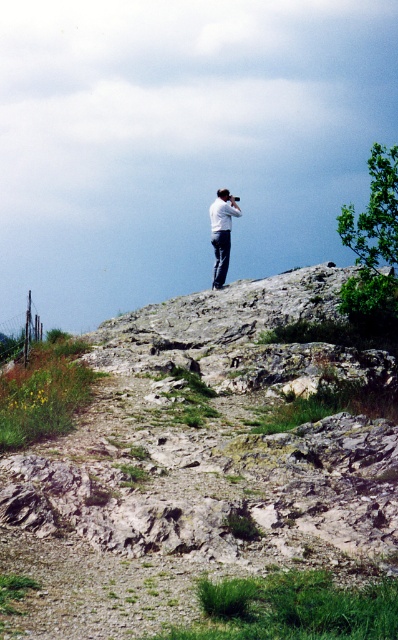
Question: Which point is farther to the camera?

Choices:
 (A) (220, 268)
 (B) (378, 474)

Answer: (A)

Question: Does gray rocky hillside at upper center appear on the left side of white fabric camera at upper center?

Choices:
 (A) yes
 (B) no

Answer: (A)

Question: Which point is closer to the camera?

Choices:
 (A) (360, 564)
 (B) (224, 266)

Answer: (A)

Question: Does gray rocky hillside at upper center appear on the left side of white fabric camera at upper center?

Choices:
 (A) no
 (B) yes

Answer: (B)

Question: Can you confirm if gray rocky hillside at upper center is positioned to the left of white fabric camera at upper center?

Choices:
 (A) no
 (B) yes

Answer: (B)